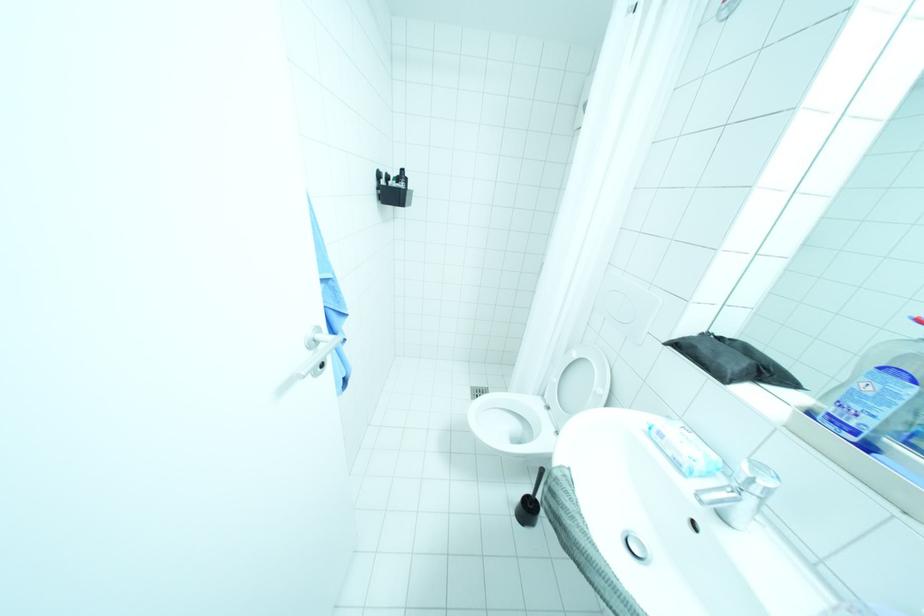
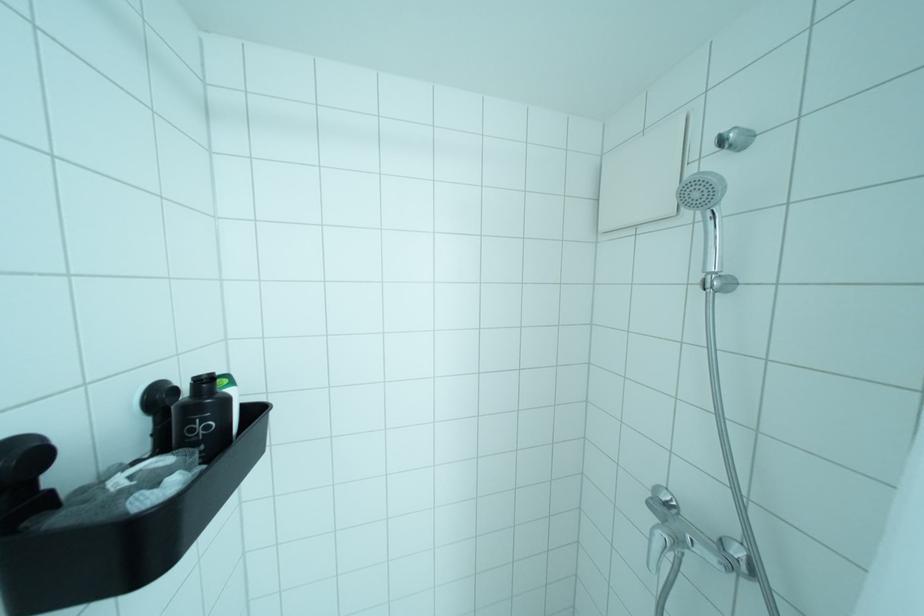
Question: What movement of the cameraman would produce the second image?

Choices:
 (A) Left
 (B) Right
 (C) Forward
 (D) Backward

Answer: (C)